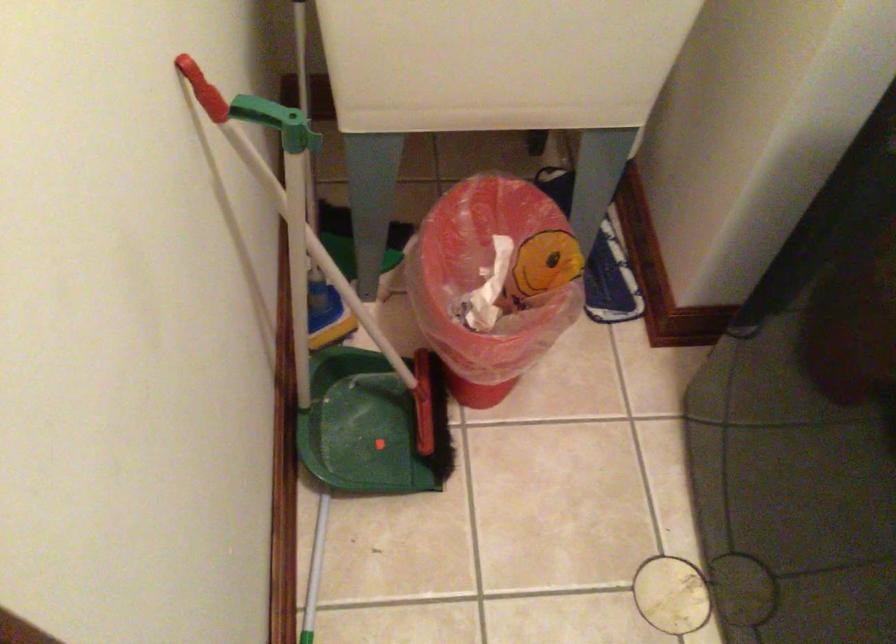
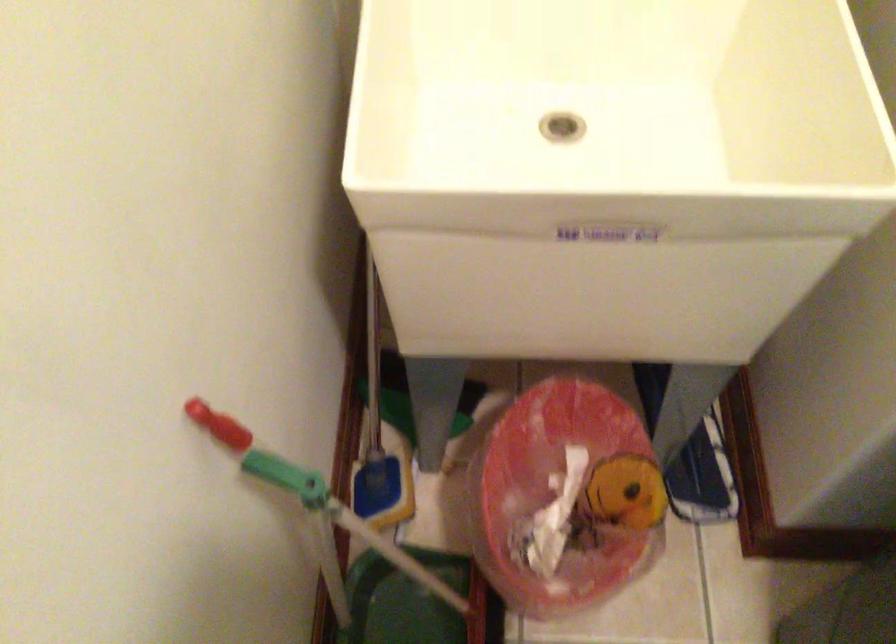
Find the pixel in the second image that matches point (486, 281) in the first image.

(555, 496)